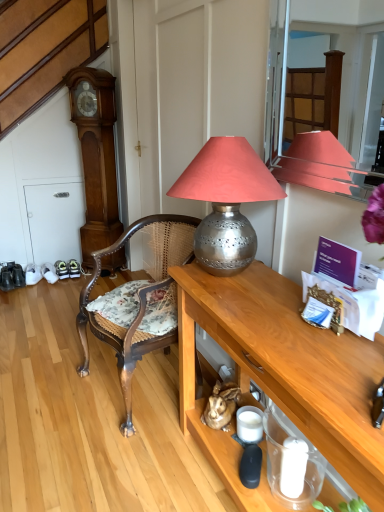
Where is `free space above wooden table at center (from a real-world perspective)`? free space above wooden table at center (from a real-world perspective) is located at coordinates pos(286,327).